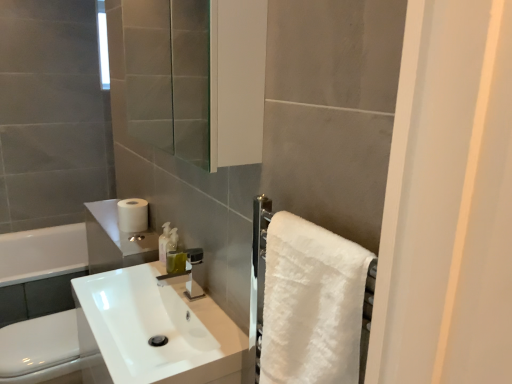
Question: From a real-world perspective, is white glossy toilet bowl at lower left physically below translucent plastic soap dispenser at center?

Choices:
 (A) yes
 (B) no

Answer: (A)

Question: Can you confirm if white glossy toilet bowl at lower left is wider than translucent plastic soap dispenser at center?

Choices:
 (A) yes
 (B) no

Answer: (A)

Question: Is white glossy toilet bowl at lower left not inside translucent plastic soap dispenser at center?

Choices:
 (A) yes
 (B) no

Answer: (A)

Question: Considering the relative sizes of white glossy toilet bowl at lower left and translucent plastic soap dispenser at center in the image provided, is white glossy toilet bowl at lower left bigger than translucent plastic soap dispenser at center?

Choices:
 (A) yes
 (B) no

Answer: (A)

Question: Is translucent plastic soap dispenser at center completely or partially inside white glossy toilet bowl at lower left?

Choices:
 (A) no
 (B) yes

Answer: (A)

Question: Is white fluffy towel at right inside or outside of white glossy toilet bowl at lower left?

Choices:
 (A) inside
 (B) outside

Answer: (B)

Question: Is white fluffy towel at right wider or thinner than white glossy toilet bowl at lower left?

Choices:
 (A) thin
 (B) wide

Answer: (A)

Question: From a real-world perspective, relative to white glossy toilet bowl at lower left, is white fluffy towel at right vertically above or below?

Choices:
 (A) above
 (B) below

Answer: (A)

Question: Is point (270, 289) positioned closer to the camera than point (77, 349)?

Choices:
 (A) closer
 (B) farther

Answer: (A)

Question: Based on their positions, is translucent plastic soap dispenser at center located to the left or right of white fluffy towel at right?

Choices:
 (A) left
 (B) right

Answer: (A)

Question: From a real-world perspective, is translucent plastic soap dispenser at center physically located above or below white fluffy towel at right?

Choices:
 (A) above
 (B) below

Answer: (B)

Question: From the image's perspective, is translucent plastic soap dispenser at center located above or below white fluffy towel at right?

Choices:
 (A) above
 (B) below

Answer: (A)

Question: Does point (165, 248) appear closer or farther from the camera than point (302, 332)?

Choices:
 (A) farther
 (B) closer

Answer: (A)

Question: Do you think translucent plastic soap dispenser at center is within white glossy sink at center, or outside of it?

Choices:
 (A) inside
 (B) outside

Answer: (A)

Question: Relative to white glossy sink at center, is translucent plastic soap dispenser at center in front or behind?

Choices:
 (A) behind
 (B) front

Answer: (A)